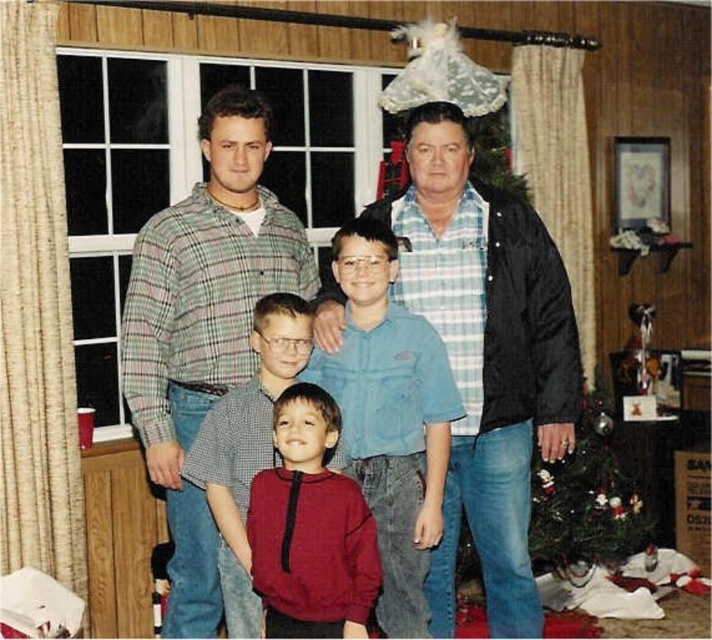
You are a photographer setting up for a family portrait. You notice the green plaid shirt at upper left and the matte blue shirt at center in the scene. Which shirt should you adjust your camera focus to ensure the subject wearing the larger shirt is in focus? Please mention both shirts in your answer.

The green plaid shirt at upper left is larger in size than the matte blue shirt at center. Therefore, you should adjust the camera focus on the green plaid shirt at upper left to ensure the subject wearing the larger shirt is in focus.